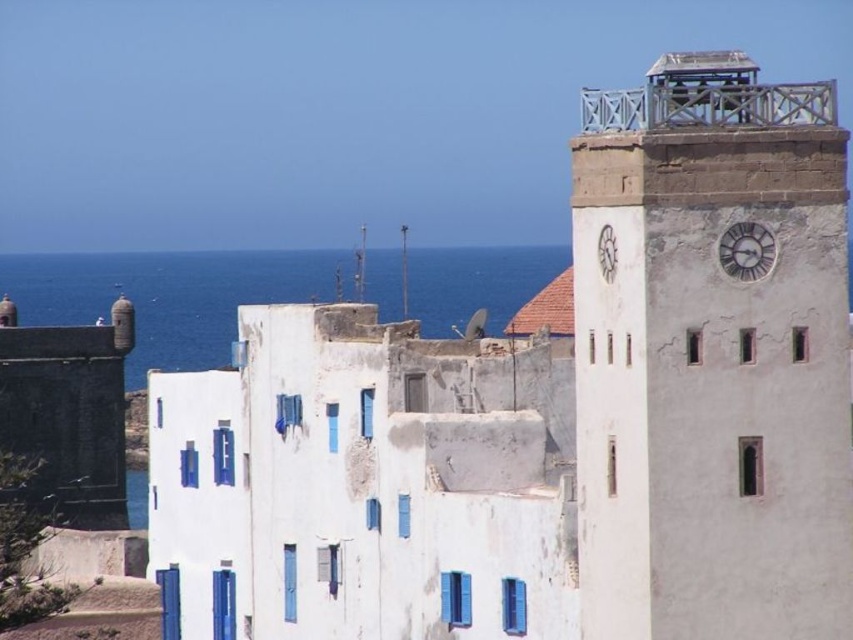
Is point (746, 556) positioned in front of point (605, 236)?

Yes, point (746, 556) is closer to viewer.

Does light brown stone clock tower at upper right appear on the left side of white matte clock at upper right?

No, light brown stone clock tower at upper right is not to the left of white matte clock at upper right.

Does point (773, 396) come behind point (611, 257)?

No, it is not.

Locate an element on the screen. Image resolution: width=853 pixels, height=640 pixels. light brown stone clock tower at upper right is located at coordinates (711, 358).

Can you confirm if light brown stone clock tower at upper right is positioned below blue water at left?

Yes, light brown stone clock tower at upper right is below blue water at left.

Does light brown stone clock tower at upper right have a greater height compared to blue water at left?

Correct, light brown stone clock tower at upper right is much taller as blue water at left.

Between point (693, 200) and point (297, 294), which one is positioned behind?

Point (297, 294)

Where is `light brown stone clock tower at upper right`? The width and height of the screenshot is (853, 640). light brown stone clock tower at upper right is located at coordinates (711, 358).

Is blue water at left to the left of silver metallic clock at upper right from the viewer's perspective?

Correct, you'll find blue water at left to the left of silver metallic clock at upper right.

Between blue water at left and silver metallic clock at upper right, which one is positioned higher?

silver metallic clock at upper right is above.

What are the coordinates of `blue water at left` in the screenshot? It's located at (169, 296).